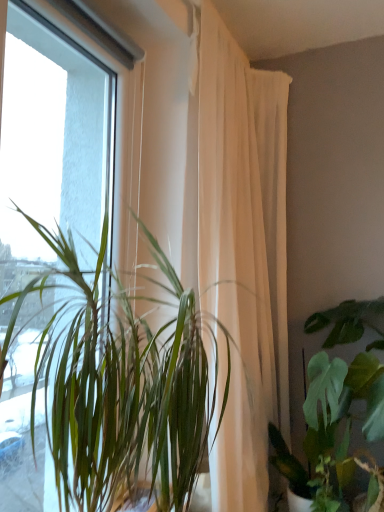
You are a GUI agent. You are given a task and a screenshot of the screen. Output one action in this format:
    pyautogui.click(x=<x>, y=<y>)
    Task: Click on the green leafy plant at left
    The height and width of the screenshot is (512, 384).
    Given the screenshot: What is the action you would take?
    pyautogui.click(x=121, y=386)

In order to face green leafy plant at left, should I rotate leftwards or rightwards?

Turn left approximately 9.959 degrees to face it.

This screenshot has width=384, height=512. What do you see at coordinates (121, 386) in the screenshot? I see `green leafy plant at left` at bounding box center [121, 386].

The height and width of the screenshot is (512, 384). Identify the location of green leafy plant at left. (121, 386).